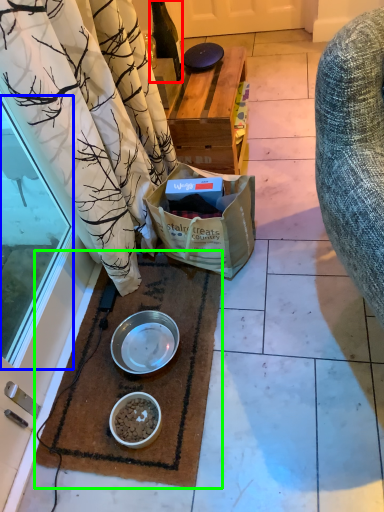
Question: Considering the real-world distances, which object is farthest from bottle (highlighted by a red box)? glass door (highlighted by a blue box) or mat (highlighted by a green box)?

Choices:
 (A) glass door
 (B) mat

Answer: (B)